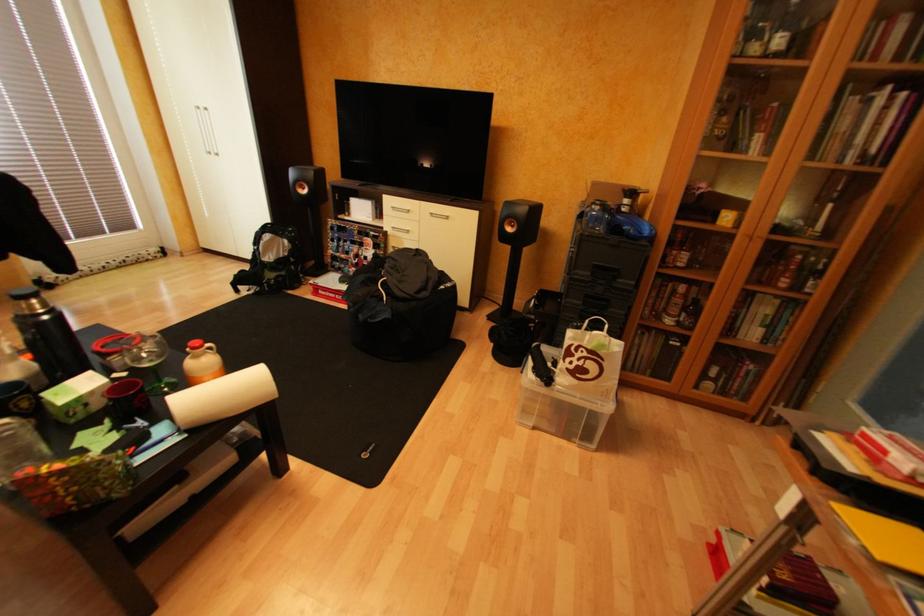
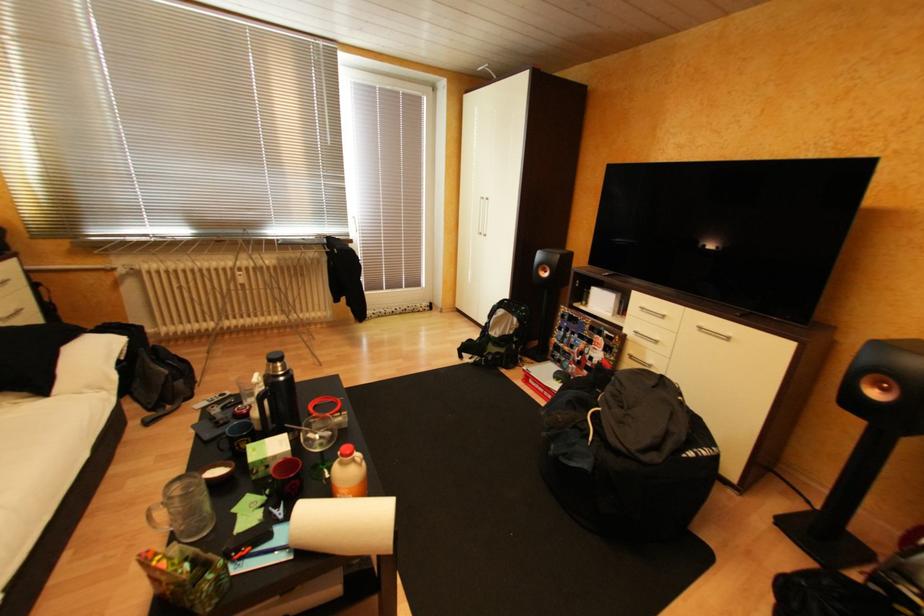
Question: The camera is either moving clockwise (left) or counter-clockwise (right) around the object. The first image is from the beginning of the video and the second image is from the end. Is the camera moving left or right when shooting the video?

Choices:
 (A) Left
 (B) Right

Answer: (B)